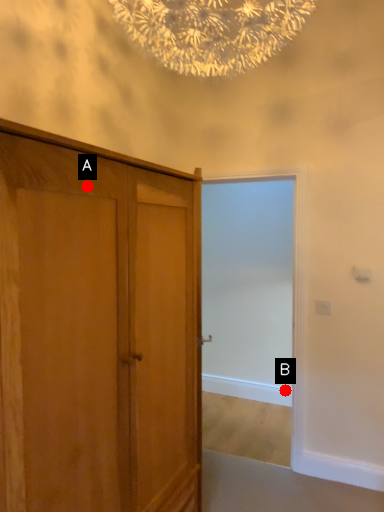
Question: Two points are circled on the image, labeled by A and B beside each circle. Which point is closer to the camera?

Choices:
 (A) A is closer
 (B) B is closer

Answer: (A)